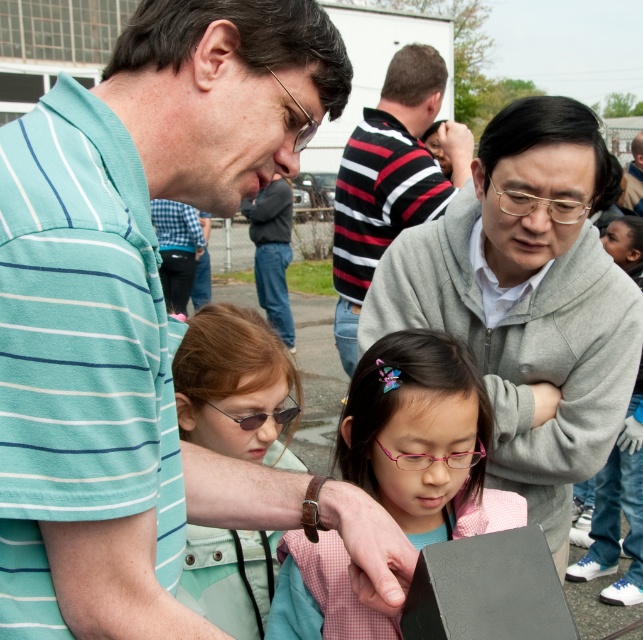
Question: Which object is closer to the camera taking this photo?

Choices:
 (A) sunglasses at center
 (B) teal striped shirt at upper left
 (C) gold metallic glasses at upper center

Answer: (B)

Question: Does gray matte sweater at upper right have a smaller size compared to pink plastic glasses at center?

Choices:
 (A) no
 (B) yes

Answer: (A)

Question: Does gold metallic glasses at upper center appear under metallic wireframe glasses at center?

Choices:
 (A) no
 (B) yes

Answer: (A)

Question: Among these points, which one is farthest from the camera?

Choices:
 (A) [431, 452]
 (B) [635, 189]
 (C) [172, 42]
 (D) [608, 589]

Answer: (B)

Question: Observing the image, what is the correct spatial positioning of striped cotton shirt at center in reference to matte gray sweater at upper right?

Choices:
 (A) right
 (B) left

Answer: (B)

Question: Based on their relative distances, which object is nearer to the dark gray sweater at center?

Choices:
 (A) gold metallic glasses at upper center
 (B) pink glossy glasses at center

Answer: (B)